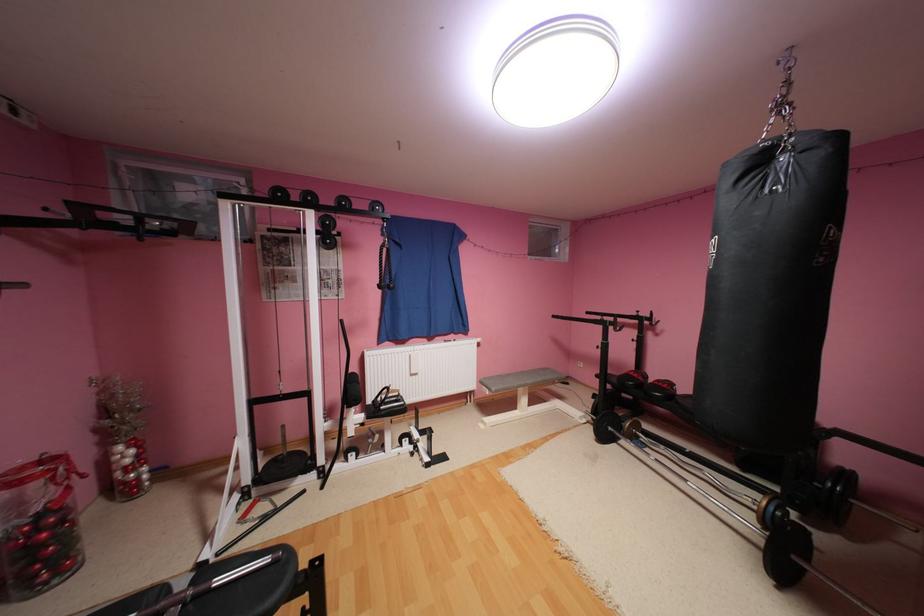
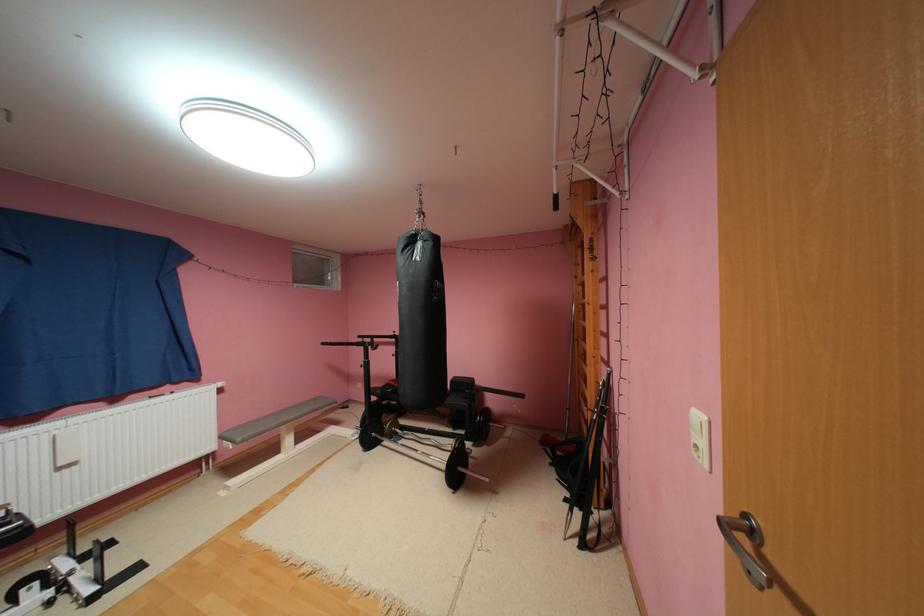
Locate, in the second image, the point that corresponds to point 538,382 in the first image.

(300, 416)